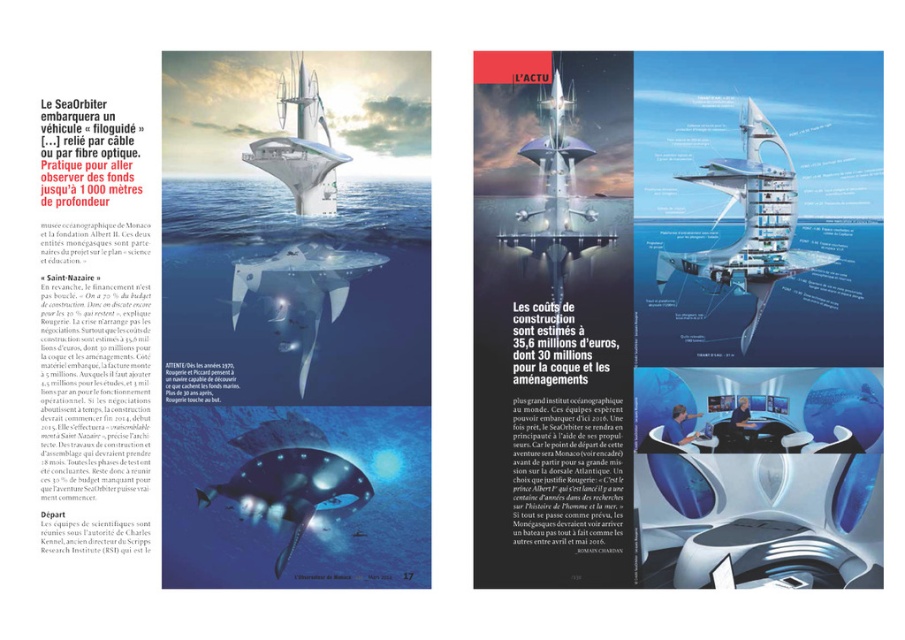
Question: Is translucent glass pod at center thinner than shiny blue glass skyscraper at upper center?

Choices:
 (A) no
 (B) yes

Answer: (A)

Question: Considering the relative positions of white glossy submarine at center and shiny silver submarine at center in the image provided, where is white glossy submarine at center located with respect to shiny silver submarine at center?

Choices:
 (A) right
 (B) left

Answer: (B)

Question: Which point is farther to the camera?

Choices:
 (A) shiny blue glass skyscraper at upper center
 (B) white glossy submarine at center
 (C) shiny silver submarine at center
 (D) translucent glass pod at center

Answer: (A)

Question: Considering the real-world distances, which object is farthest from the translucent glass pod at center?

Choices:
 (A) white glossy submarine at center
 (B) shiny blue glass skyscraper at upper center

Answer: (B)

Question: Which object is farther from the camera taking this photo?

Choices:
 (A) shiny blue glass skyscraper at upper center
 (B) translucent glass pod at center

Answer: (A)

Question: Where is white glossy submarine at center located in relation to translucent glass pod at center in the image?

Choices:
 (A) right
 (B) left

Answer: (B)